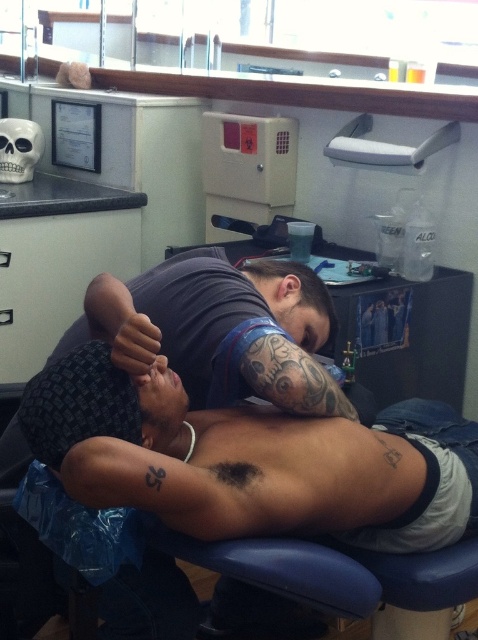
From the picture: You are a new tattoo artist entering the studio and need to position a client so that the black skin muscle at center can be tattooed. Given that the black ink tattoo at center is already on the client, where should you place the client relative to your position?

Since the black skin muscle at center is to the right of the black ink tattoo at center, you should position the client to your left so that you can access the area to the right of the existing black ink tattoo at center.

From the picture: You are a photographer standing in the studio and want to take a photo of the dark skin tattooed arm at center. The camera you are using has a minimum focusing distance of 3 feet. Can you take a clear photo without moving the camera or the arm?

The dark skin tattooed arm at center and camera are 3.35 feet apart. Since the minimum focusing distance is 3 feet, the camera can focus on the dark skin tattooed arm at center as the distance is within the required range.

You are a client in the tattoo parlor and want to know if the tattoo artist can fit a new design on your arm. The artist shows you the dark skin tattooed arm at center and the black ink tattoo at center. Which object has a larger width, and does this indicate the new design can fit?

The dark skin tattooed arm at center has a larger width than the black ink tattoo at center. This suggests that the new design could potentially fit on your arm, as there is more space available compared to the smaller tattoo.